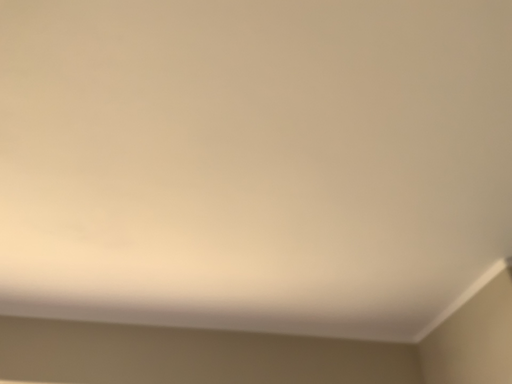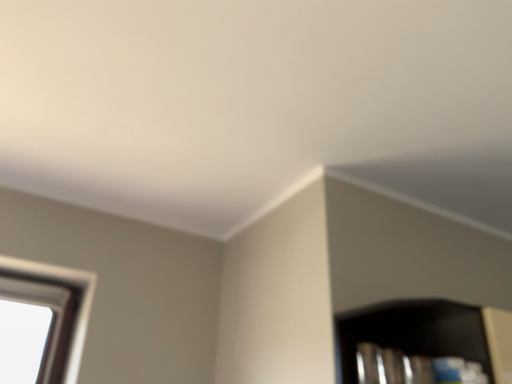
Question: Which way did the camera rotate in the video?

Choices:
 (A) rotated downward
 (B) rotated upward

Answer: (A)